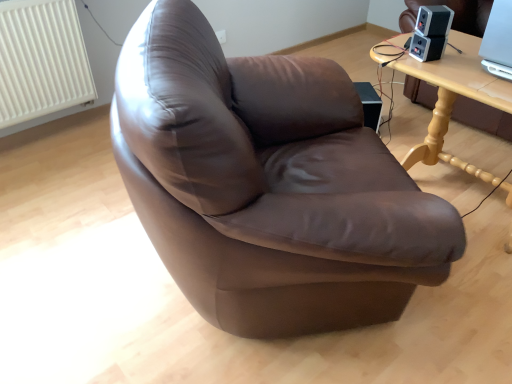
Question: Does light wood table at upper right touch white textured radiator at upper left?

Choices:
 (A) yes
 (B) no

Answer: (B)

Question: Is light wood table at upper right at the right side of white textured radiator at upper left?

Choices:
 (A) yes
 (B) no

Answer: (A)

Question: Does light wood table at upper right have a smaller size compared to white textured radiator at upper left?

Choices:
 (A) yes
 (B) no

Answer: (B)

Question: From the image's perspective, is light wood table at upper right beneath white textured radiator at upper left?

Choices:
 (A) yes
 (B) no

Answer: (A)

Question: Can you confirm if light wood table at upper right is taller than white textured radiator at upper left?

Choices:
 (A) yes
 (B) no

Answer: (B)

Question: From a real-world perspective, is light wood table at upper right physically below white textured radiator at upper left?

Choices:
 (A) no
 (B) yes

Answer: (B)

Question: Is light wood table at upper right to the left of satin black speaker at upper right, the 2th speaker when ordered from top to bottom, from the viewer's perspective?

Choices:
 (A) yes
 (B) no

Answer: (B)

Question: Is light wood table at upper right closer to camera compared to satin black speaker at upper right, the 1th speaker when ordered from bottom to top?

Choices:
 (A) no
 (B) yes

Answer: (B)

Question: Is light wood table at upper right to the right of satin black speaker at upper right, the 1th speaker when ordered from bottom to top, from the viewer's perspective?

Choices:
 (A) yes
 (B) no

Answer: (A)

Question: Is the surface of light wood table at upper right in direct contact with satin black speaker at upper right, the 1th speaker when ordered from bottom to top?

Choices:
 (A) yes
 (B) no

Answer: (B)

Question: Is the position of light wood table at upper right more distant than that of satin black speaker at upper right, the 1th speaker when ordered from bottom to top?

Choices:
 (A) no
 (B) yes

Answer: (A)

Question: Is light wood table at upper right oriented towards satin black speaker at upper right, the 2th speaker when ordered from top to bottom?

Choices:
 (A) yes
 (B) no

Answer: (B)

Question: Are satin black speaker at upper right, the 1th speaker when ordered from bottom to top, and white textured radiator at upper left far apart?

Choices:
 (A) no
 (B) yes

Answer: (B)